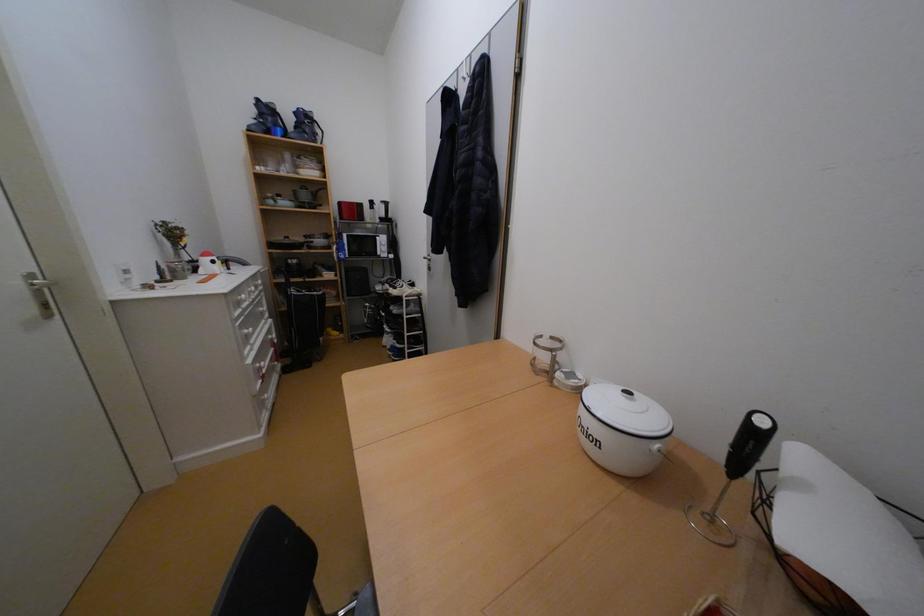
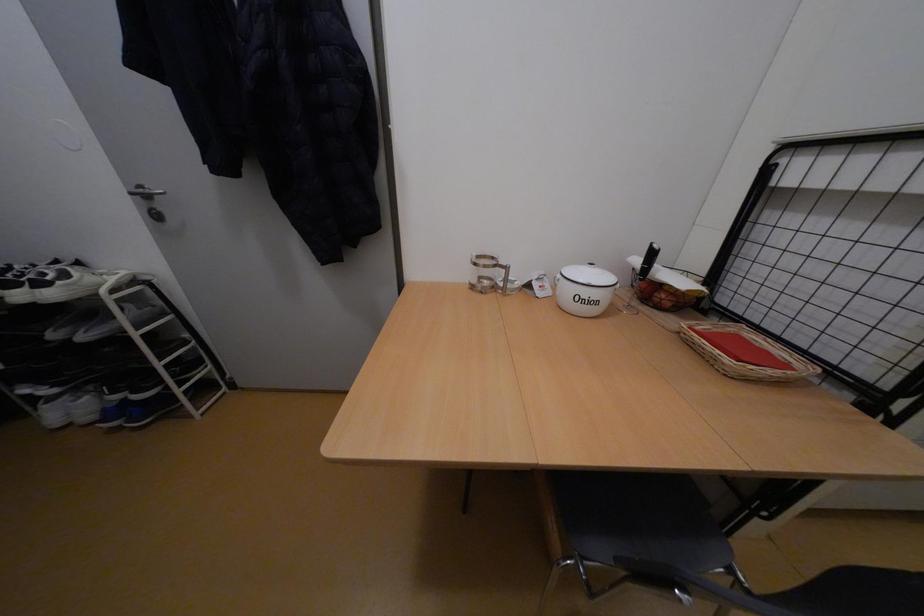
How did the camera likely rotate?

The camera's rotation is toward right-down.